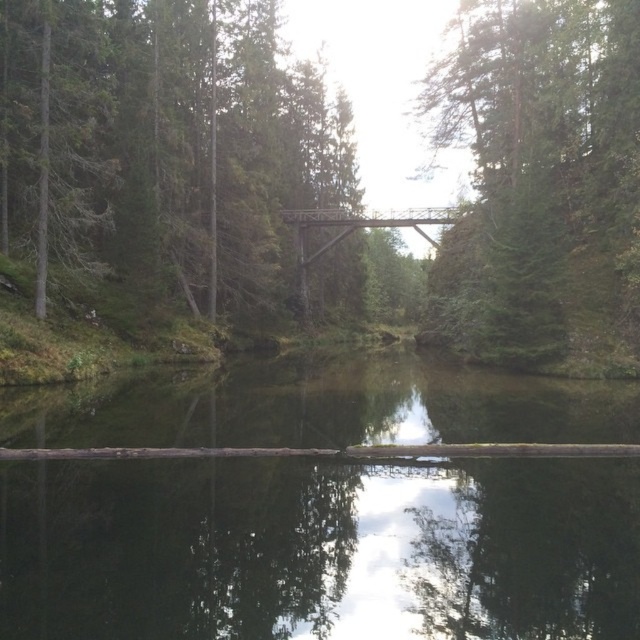
Question: Considering the relative positions of green matte tree at upper center and rusty metal bridge at center in the image provided, where is green matte tree at upper center located with respect to rusty metal bridge at center?

Choices:
 (A) right
 (B) left

Answer: (A)

Question: Which object appears closest to the camera in this image?

Choices:
 (A) rusty metal bridge at center
 (B) green matte tree at upper center
 (C) greenish-brown wood at center
 (D) brown wood bridge at center

Answer: (C)

Question: Is greenish-brown wood at center bigger than green matte tree at upper center?

Choices:
 (A) yes
 (B) no

Answer: (B)

Question: Which of these objects is positioned farthest from the rusty metal bridge at center?

Choices:
 (A) greenish-brown wood at center
 (B) brown wood bridge at center

Answer: (A)

Question: Which point is closer to the camera?

Choices:
 (A) (236, 474)
 (B) (330, 243)

Answer: (A)

Question: Considering the relative positions of greenish-brown wood at center and brown wood bridge at center in the image provided, where is greenish-brown wood at center located with respect to brown wood bridge at center?

Choices:
 (A) right
 (B) left

Answer: (A)